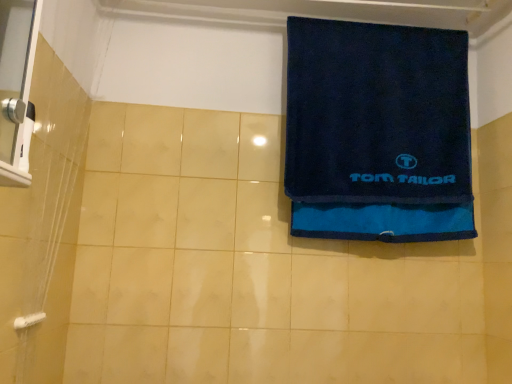
Question: Is white plastic towel bar at lower left closer to camera compared to dark blue terry cloth towel at upper right?

Choices:
 (A) yes
 (B) no

Answer: (A)

Question: Is white plastic towel bar at lower left positioned with its back to dark blue terry cloth towel at upper right?

Choices:
 (A) yes
 (B) no

Answer: (B)

Question: Does white plastic towel bar at lower left have a larger size compared to dark blue terry cloth towel at upper right?

Choices:
 (A) yes
 (B) no

Answer: (B)

Question: Is white plastic towel bar at lower left to the left of dark blue terry cloth towel at upper right from the viewer's perspective?

Choices:
 (A) yes
 (B) no

Answer: (A)

Question: Considering the relative sizes of white plastic towel bar at lower left and dark blue terry cloth towel at upper right in the image provided, is white plastic towel bar at lower left wider than dark blue terry cloth towel at upper right?

Choices:
 (A) yes
 (B) no

Answer: (B)

Question: Is white plastic towel bar at lower left far away from dark blue terry cloth towel at upper right?

Choices:
 (A) no
 (B) yes

Answer: (B)

Question: Is dark blue terry cloth towel at upper right smaller than white plastic towel bar at lower left?

Choices:
 (A) no
 (B) yes

Answer: (A)

Question: Is the position of dark blue terry cloth towel at upper right less distant than that of white plastic towel bar at lower left?

Choices:
 (A) no
 (B) yes

Answer: (A)

Question: From the image's perspective, would you say dark blue terry cloth towel at upper right is shown under white plastic towel bar at lower left?

Choices:
 (A) yes
 (B) no

Answer: (B)

Question: Is dark blue terry cloth towel at upper right placed right next to white plastic towel bar at lower left?

Choices:
 (A) yes
 (B) no

Answer: (B)

Question: Is dark blue terry cloth towel at upper right facing towards white plastic towel bar at lower left?

Choices:
 (A) yes
 (B) no

Answer: (B)

Question: From a real-world perspective, is dark blue terry cloth towel at upper right positioned over white plastic towel bar at lower left based on gravity?

Choices:
 (A) yes
 (B) no

Answer: (A)

Question: In terms of size, does dark blue terry cloth towel at upper right appear bigger or smaller than white plastic towel bar at lower left?

Choices:
 (A) big
 (B) small

Answer: (A)